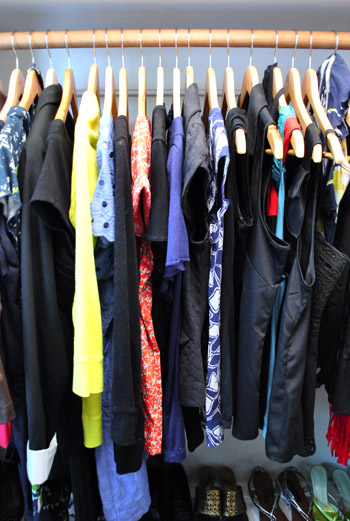
This screenshot has width=350, height=521. I want to click on closet rod, so click(x=152, y=35).